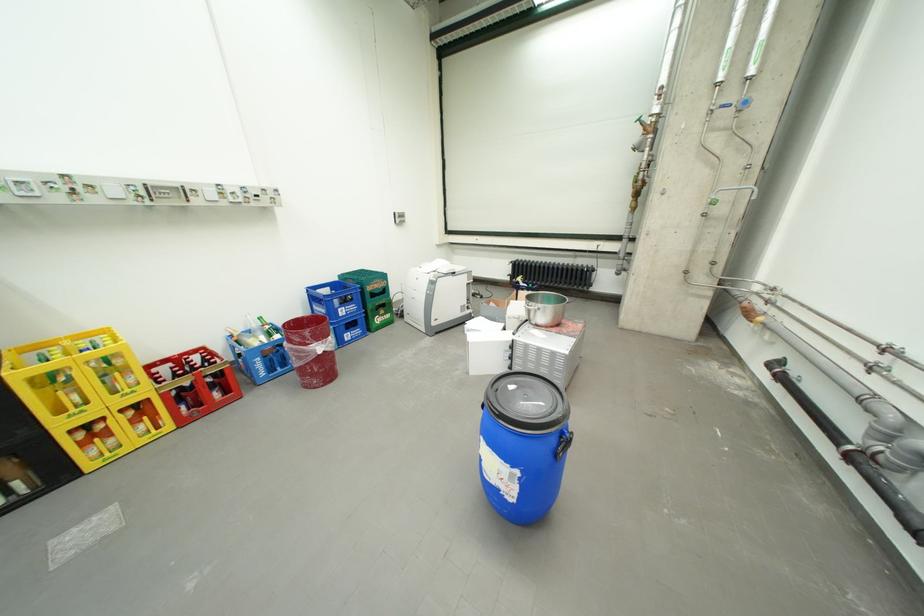
Where would you lift the red crate? Please return your answer as a coordinate pair (x, y).

(201, 389)